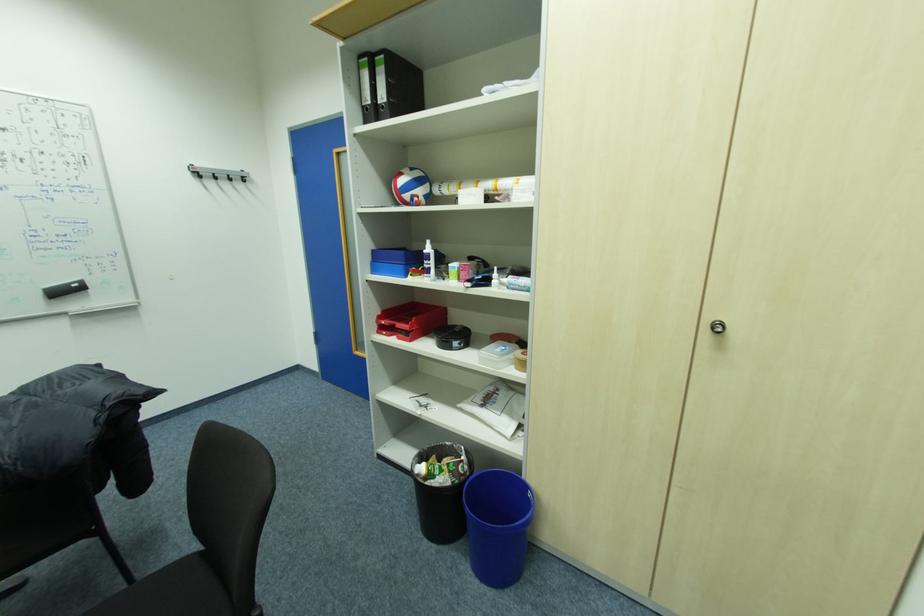
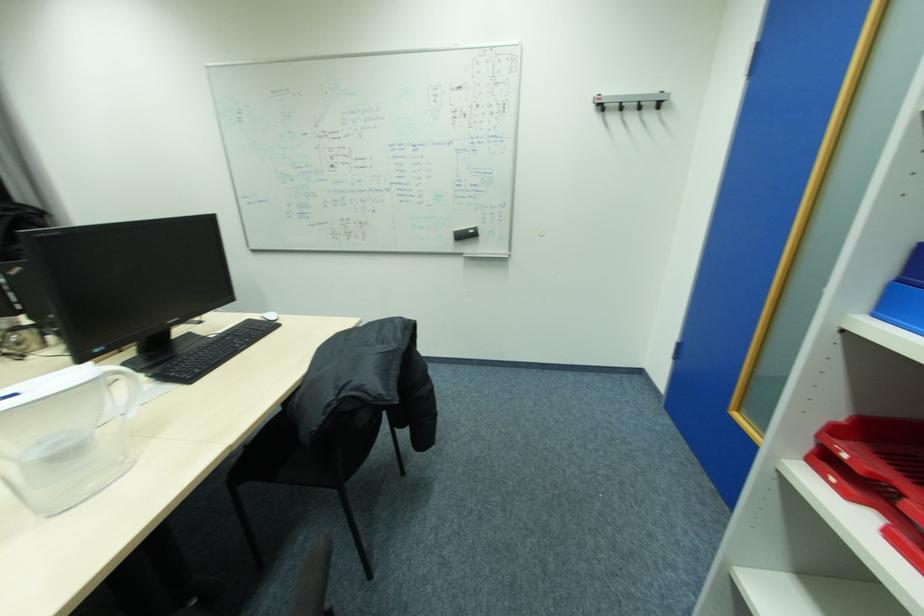
Question: The images are taken continuously from a first-person perspective. In which direction is your viewpoint rotating?

Choices:
 (A) Left
 (B) Right
 (C) Up
 (D) Down

Answer: (A)